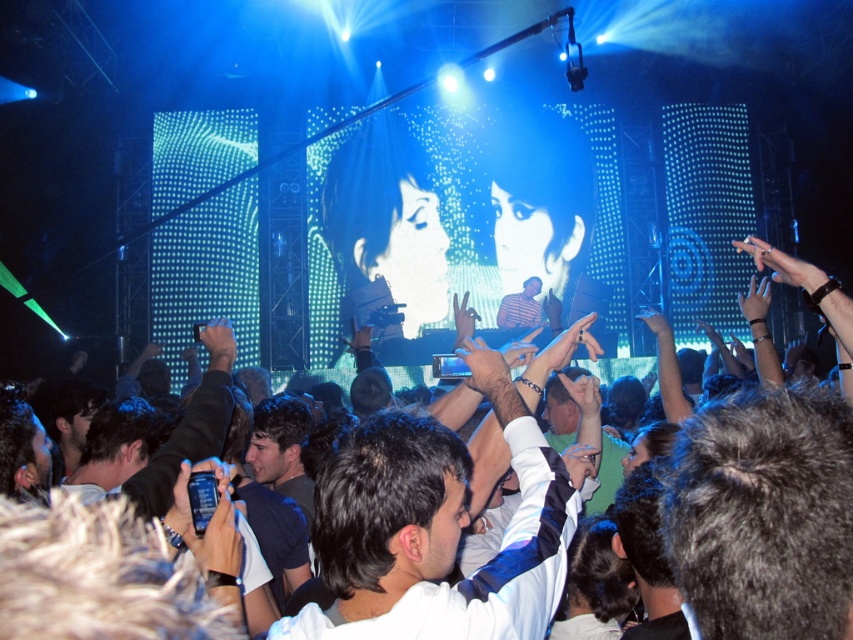
Describe the element at coordinates (436, 528) in the screenshot. I see `white shirt at center` at that location.

The width and height of the screenshot is (853, 640). Identify the location of white shirt at center. (436, 528).